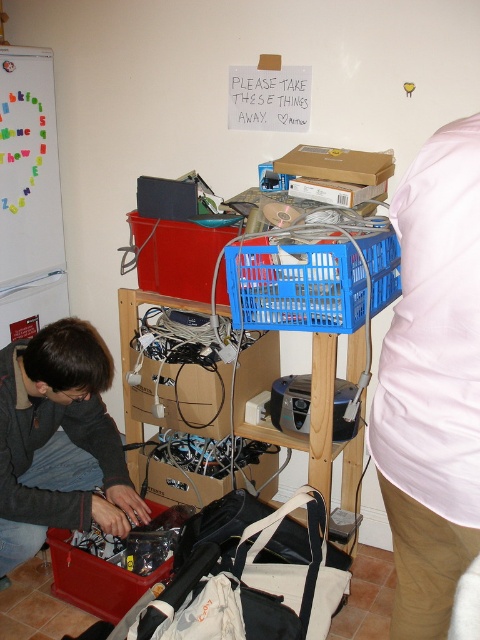
You are organizing the storage area and need to move the matte black laptop at lower left to a higher shelf. Is the matte plastic crate at center currently blocking the space where you want to place it?

The matte black laptop at lower left is below the matte plastic crate at center, so moving it to the location currently occupied by the matte plastic crate at center would require relocating the crate first.

You are organizing the storage area and need to move the matte plastic toolbox at lower left closer to the matte plastic crate at center. Which direction should you move it?

The matte plastic crate at center is positioned on the right side of the matte plastic toolbox at lower left, so you should move the matte plastic toolbox at lower left to the right to bring it closer to the matte plastic crate at center.

You are moving a 15 inch laptop bag from the matte black laptop at lower left to the matte plastic crate at center. Will the bag fit through the space between them?

The distance between the matte black laptop at lower left and the matte plastic crate at center is 21.66 inches. Since the laptop bag is 15 inches wide, it can fit through the space as the distance is greater than the bag width.